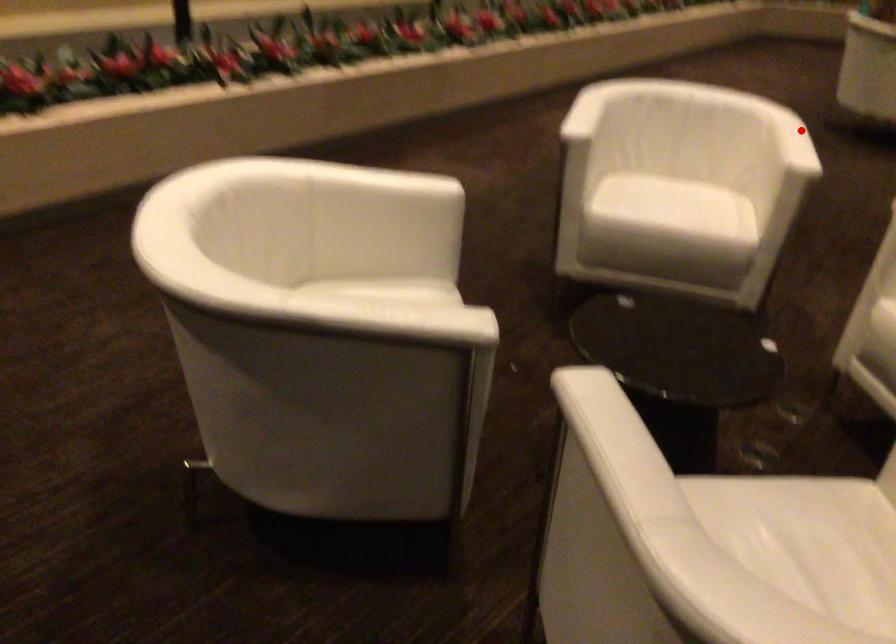
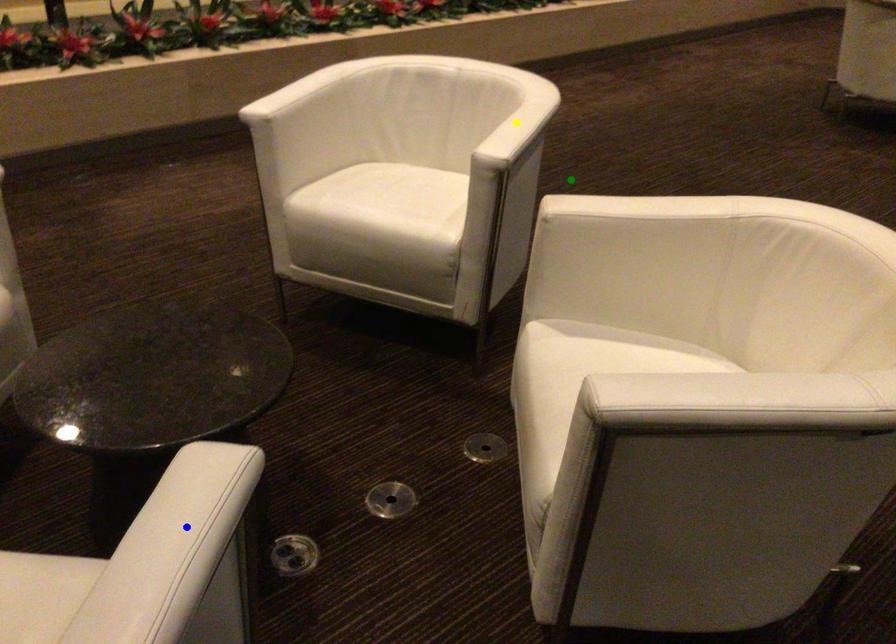
Question: I am providing you with two images of the same scene from different viewpoints. A red point is marked on the first image. You are given multiple points on the second image. Which mark in image 2 goes with the point in image 1?

Choices:
 (A) green point
 (B) yellow point
 (C) blue point

Answer: (B)